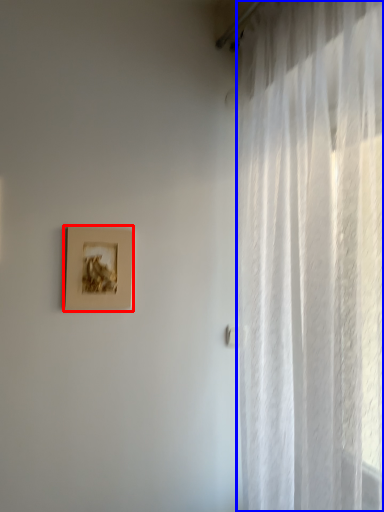
Question: Which object is closer to the camera taking this photo, picture frame (highlighted by a red box) or curtain (highlighted by a blue box)?

Choices:
 (A) picture frame
 (B) curtain

Answer: (B)